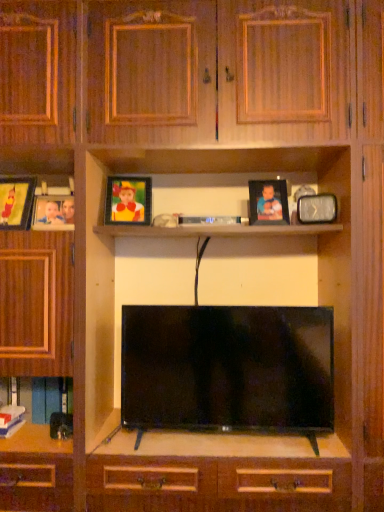
Question: Is blue paper book at lower left, which is counted as the 2th book, starting from the back, to the left or to the right of hardcover book at lower left, the 1th book when ordered from back to front, in the image?

Choices:
 (A) left
 (B) right

Answer: (A)

Question: From a real-world perspective, relative to hardcover book at lower left, the 1th book when ordered from back to front, is blue paper book at lower left, which appears as the first book when viewed from the front, vertically above or below?

Choices:
 (A) below
 (B) above

Answer: (A)

Question: Which is nearer to the metallic rectangular clock at upper right, placed as the first picture frame when sorted from right to left?

Choices:
 (A) matte plastic picture frame at left, the fourth picture frame when ordered from right to left
 (B) matte black picture frame at upper center, positioned as the second picture frame in right-to-left order
 (C) matte plastic picture frame at upper center, the 3th picture frame in the right-to-left sequence
 (D) blue paper book at lower left, which appears as the first book when viewed from the front
 (E) matte wooden picture frame at left, the fifth picture frame in the right-to-left sequence

Answer: (B)

Question: Based on their relative distances, which object is farther from the metallic rectangular clock at upper right, placed as the first picture frame when sorted from right to left?

Choices:
 (A) matte wooden picture frame at left, arranged as the first picture frame when viewed from the left
 (B) hardcover book at lower left, positioned as the 2th book in front-to-back order
 (C) blue paper book at lower left, which is counted as the 2th book, starting from the back
 (D) matte plastic picture frame at left, the second picture frame viewed from the left
 (E) black glossy flat-screen tv at center

Answer: (C)